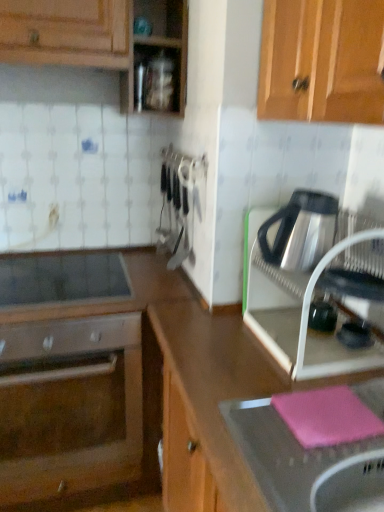
Question: From the image's perspective, is pink rubber mat at lower right under satin silver kettle at right, which ranks as the 2th kitchen appliance in bottom-to-top order?

Choices:
 (A) yes
 (B) no

Answer: (A)

Question: Is pink rubber mat at lower right looking in the opposite direction of satin silver kettle at right, acting as the 1th kitchen appliance starting from the top?

Choices:
 (A) no
 (B) yes

Answer: (A)

Question: Does pink rubber mat at lower right have a lesser height compared to satin silver kettle at right, acting as the 1th kitchen appliance starting from the top?

Choices:
 (A) yes
 (B) no

Answer: (B)

Question: Can you confirm if pink rubber mat at lower right is taller than satin silver kettle at right, which ranks as the 2th kitchen appliance in bottom-to-top order?

Choices:
 (A) no
 (B) yes

Answer: (B)

Question: Is pink rubber mat at lower right surrounding satin silver kettle at right, acting as the 1th kitchen appliance starting from the top?

Choices:
 (A) no
 (B) yes

Answer: (A)

Question: From a real-world perspective, is pink rubber mat at lower right beneath satin silver kettle at right, which ranks as the 2th kitchen appliance in bottom-to-top order?

Choices:
 (A) yes
 (B) no

Answer: (A)

Question: Could you tell me if pink rubber mat at lower right is facing satin silver oven at lower left?

Choices:
 (A) yes
 (B) no

Answer: (B)

Question: From a real-world perspective, is pink rubber mat at lower right beneath satin silver oven at lower left?

Choices:
 (A) yes
 (B) no

Answer: (B)

Question: Would you say pink rubber mat at lower right is a long distance from satin silver oven at lower left?

Choices:
 (A) yes
 (B) no

Answer: (A)

Question: Is pink rubber mat at lower right outside satin silver oven at lower left?

Choices:
 (A) yes
 (B) no

Answer: (A)

Question: Does pink rubber mat at lower right have a lesser width compared to satin silver oven at lower left?

Choices:
 (A) no
 (B) yes

Answer: (B)

Question: Is pink rubber mat at lower right positioned before satin silver oven at lower left?

Choices:
 (A) no
 (B) yes

Answer: (B)

Question: Considering the relative sizes of smooth glass cooktop at center-left and satin silver kettle at right, acting as the 1th kitchen appliance starting from the top, in the image provided, is smooth glass cooktop at center-left shorter than satin silver kettle at right, acting as the 1th kitchen appliance starting from the top,?

Choices:
 (A) yes
 (B) no

Answer: (A)